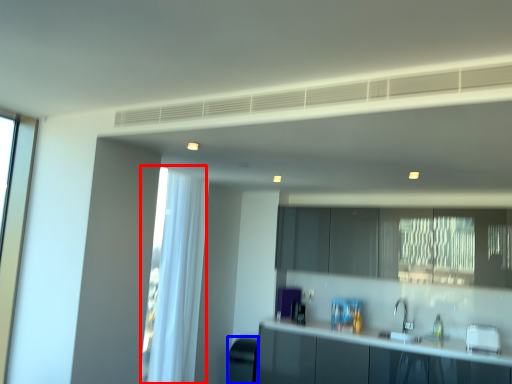
Question: Which object is further to the camera taking this photo, curtain (highlighted by a red box) or appliance (highlighted by a blue box)?

Choices:
 (A) curtain
 (B) appliance

Answer: (B)